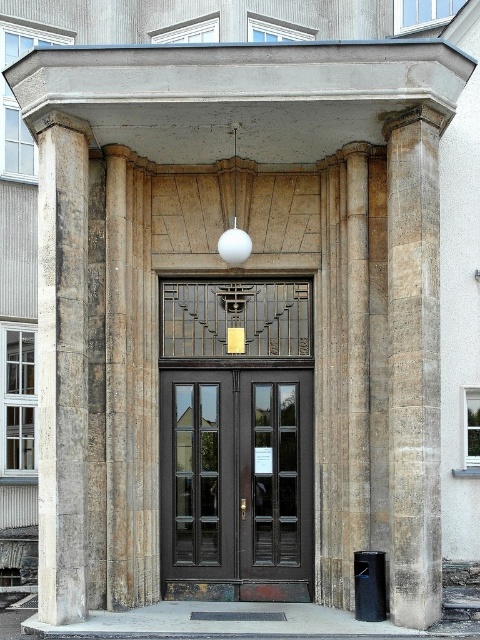
You are standing at the entrance of the building and want to locate two points marked on the facade. The first point is at coordinates point (81, 605) and the second is at point (238, 595). Which point is closer to you as you face the entrance?

Point (81, 605) is closer to you because it is in front of point (238, 595).

You are an architect inspecting the building entrance. You need to install a new security camera on the light beige stone column at left and the dark brown wood door at center. Which object allows for a larger camera mount due to its size?

The light beige stone column at left has a larger size compared to the dark brown wood door at center, so it can accommodate a larger camera mount.

You are a delivery person trying to enter the building. You have a large package that is 2 meters tall. The dark brown wood door at center and the dark wood door at center are both potential entry points. Which door should you choose to ensure your package can fit through?

The dark brown wood door at center has a lesser height compared to dark wood door at center, so you should choose the dark wood door at center to ensure your package can fit through.